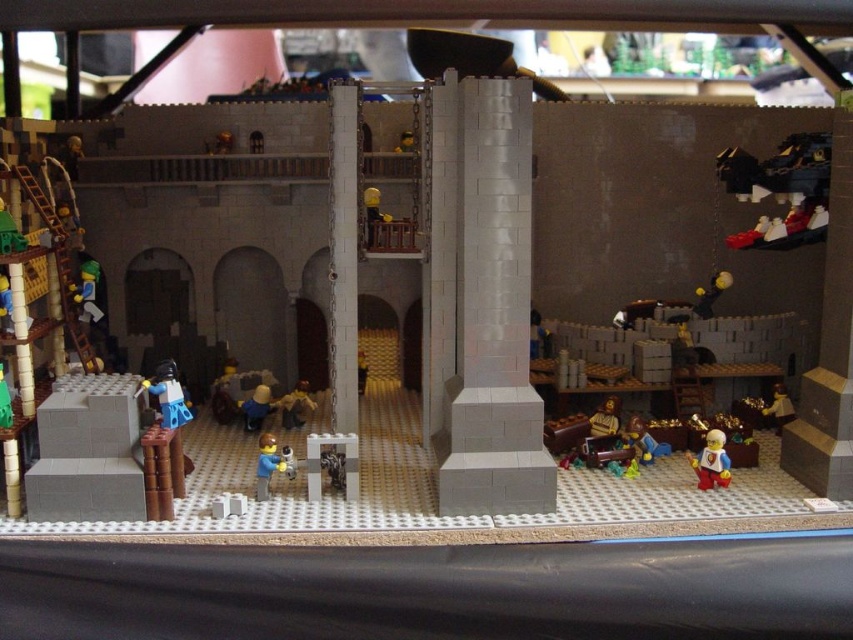
Who is more forward, [717,442] or [762,413]?

Positioned in front is point [717,442].

Between light blue plastic figure at lower right and smooth brown chest at lower right, which one has less height?

smooth brown chest at lower right

Between point (712, 438) and point (786, 406), which one is positioned behind?

Point (786, 406)

Find the location of `light blue plastic figure at lower right`. light blue plastic figure at lower right is located at coordinates (711, 461).

Does blue matte figure at center lie behind smooth gold coin at center?

No.

Can you confirm if blue matte figure at center is shorter than smooth gold coin at center?

Incorrect, blue matte figure at center's height does not fall short of smooth gold coin at center's.

In order to click on blue matte figure at center in this screenshot , I will do `click(256, 406)`.

Is smooth brown chest at lower right thinner than smooth yellow helmet at upper center?

Incorrect, smooth brown chest at lower right's width is not less than smooth yellow helmet at upper center's.

Who is more distant from viewer, (x=776, y=422) or (x=387, y=220)?

Point (x=776, y=422)

Identify the location of smooth brown chest at lower right. This screenshot has height=640, width=853. (779, 406).